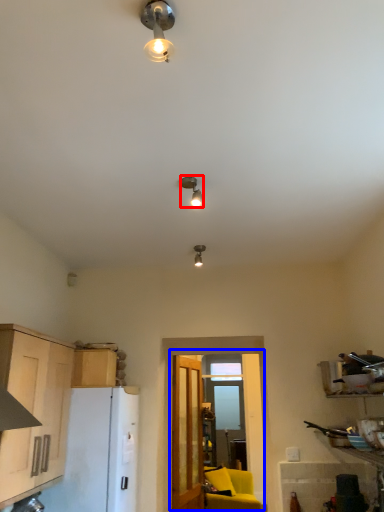
Question: Among these objects, which one is farthest to the camera, lamp (highlighted by a red box) or glass door (highlighted by a blue box)?

Choices:
 (A) lamp
 (B) glass door

Answer: (B)